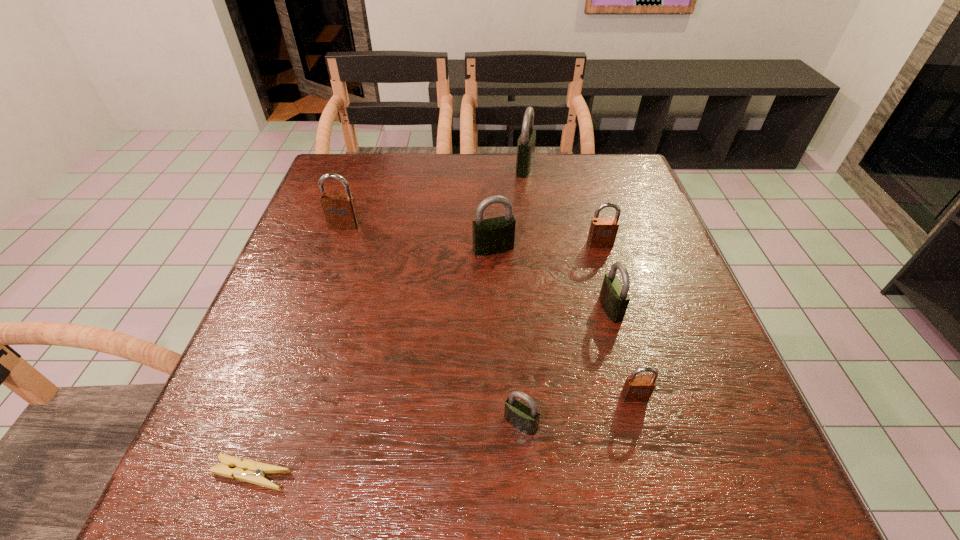
You are a GUI agent. You are given a task and a screenshot of the screen. Output one action in this format:
    pyautogui.click(x=<x>, y=<y>)
    Task: Click on the vacant region between the nearest object and the fourth nearest object
    This screenshot has width=960, height=540.
    Given the screenshot: What is the action you would take?
    pyautogui.click(x=431, y=392)

Identify which object is located as the nearest to the second biggest black padlock. Please provide its 2D coordinates. Your answer should be formatted as a tuple, i.e. [(x, y)], where the tuple contains the x and y coordinates of a point satisfying the conditions above.

[(603, 231)]

Identify which object is the fourth closest to the fourth object from right to left. Please provide its 2D coordinates. Your answer should be formatted as a tuple, i.e. [(x, y)], where the tuple contains the x and y coordinates of a point satisfying the conditions above.

[(614, 298)]

Choose which padlock is the fourth nearest neighbor to the sixth farthest padlock. Please provide its 2D coordinates. Your answer should be formatted as a tuple, i.e. [(x, y)], where the tuple contains the x and y coordinates of a point satisfying the conditions above.

[(491, 236)]

Identify which padlock is the fourth nearest to the smallest black padlock. Please provide its 2D coordinates. Your answer should be formatted as a tuple, i.e. [(x, y)], where the tuple contains the x and y coordinates of a point satisfying the conditions above.

[(603, 231)]

The height and width of the screenshot is (540, 960). What are the coordinates of `the third closest black padlock to the second smallest black padlock` in the screenshot? It's located at (526, 143).

Point out which black padlock is positioned as the second nearest to the seventh farthest object. Please provide its 2D coordinates. Your answer should be formatted as a tuple, i.e. [(x, y)], where the tuple contains the x and y coordinates of a point satisfying the conditions above.

[(491, 236)]

Select which brown padlock is the closest to the second farthest brown padlock. Please provide its 2D coordinates. Your answer should be formatted as a tuple, i.e. [(x, y)], where the tuple contains the x and y coordinates of a point satisfying the conditions above.

[(636, 388)]

You are a GUI agent. You are given a task and a screenshot of the screen. Output one action in this format:
    pyautogui.click(x=<x>, y=<y>)
    Task: Click on the brown padlock that stands as the second closest to the second farthest brown padlock
    This screenshot has width=960, height=540.
    Given the screenshot: What is the action you would take?
    pyautogui.click(x=340, y=211)